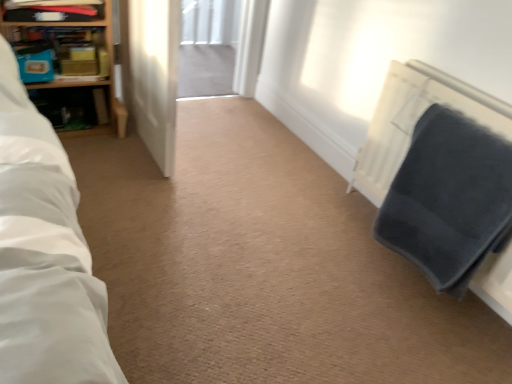
Find the location of a particular element. The image size is (512, 384). wooden bookcase at upper left is located at coordinates (70, 67).

How much space does wooden bookshelf at upper left, which is counted as the 1th shelf, starting from the bottom, occupy horizontally?

wooden bookshelf at upper left, which is counted as the 1th shelf, starting from the bottom, is 3.70 inches wide.

Image resolution: width=512 pixels, height=384 pixels. Describe the element at coordinates (152, 73) in the screenshot. I see `transparent glass screen door at center` at that location.

Locate an element on the screen. This screenshot has width=512, height=384. dark grey textured blanket at right is located at coordinates (449, 199).

This screenshot has width=512, height=384. Describe the element at coordinates (55, 12) in the screenshot. I see `wooden shelf at upper left, which is the 2th shelf in bottom-to-top order` at that location.

At what (x,y) coordinates should I click in order to perform the action: click on wooden bookcase at upper left. Please return your answer as a coordinate pair (x, y). Image resolution: width=512 pixels, height=384 pixels. Looking at the image, I should click on (70, 67).

Looking at this image, which of these two, wooden bookcase at upper left or dark grey textured blanket at right, stands taller?

wooden bookcase at upper left.

Which is more to the left, wooden bookcase at upper left or dark grey textured blanket at right?

From the viewer's perspective, wooden bookcase at upper left appears more on the left side.

What's the angular difference between wooden bookcase at upper left and dark grey textured blanket at right's facing directions?

wooden bookcase at upper left and dark grey textured blanket at right are facing 87.2 degrees away from each other.

Are wooden bookcase at upper left and dark grey textured blanket at right located far from each other?

Yes.

Based on the photo, can you confirm if wooden bookcase at upper left is positioned to the left of transparent glass screen door at center?

Correct, you'll find wooden bookcase at upper left to the left of transparent glass screen door at center.

Does point (86, 34) come closer to viewer compared to point (155, 127)?

No, it is behind (155, 127).

Considering the sizes of objects wooden bookcase at upper left and transparent glass screen door at center in the image provided, who is thinner, wooden bookcase at upper left or transparent glass screen door at center?

Thinner between the two is wooden bookcase at upper left.

From a real-world perspective, which is physically below, wooden bookcase at upper left or transparent glass screen door at center?

wooden bookcase at upper left.

Consider the image. Choose the correct answer: Is wooden shelf at upper left, which is the 2th shelf in bottom-to-top order, inside dark grey textured blanket at right or outside it?

wooden shelf at upper left, which is the 2th shelf in bottom-to-top order, is spatially situated outside dark grey textured blanket at right.

From the picture: Who is bigger, wooden shelf at upper left, which appears as the 1th shelf when viewed from the top, or dark grey textured blanket at right?

With larger size is dark grey textured blanket at right.

Based on the photo, considering the sizes of wooden shelf at upper left, which appears as the 1th shelf when viewed from the top, and dark grey textured blanket at right in the image, is wooden shelf at upper left, which appears as the 1th shelf when viewed from the top, wider or thinner than dark grey textured blanket at right?

In the image, wooden shelf at upper left, which appears as the 1th shelf when viewed from the top, appears to be wider than dark grey textured blanket at right.

In terms of size, does transparent glass screen door at center appear bigger or smaller than wooden bookshelf at upper left, acting as the second shelf starting from the top?

transparent glass screen door at center is bigger than wooden bookshelf at upper left, acting as the second shelf starting from the top.

Which is correct: transparent glass screen door at center is inside wooden bookshelf at upper left, acting as the second shelf starting from the top, or outside of it?

transparent glass screen door at center is outside wooden bookshelf at upper left, acting as the second shelf starting from the top.

Are transparent glass screen door at center and wooden bookshelf at upper left, which is counted as the 1th shelf, starting from the bottom, beside each other?

There is a gap between transparent glass screen door at center and wooden bookshelf at upper left, which is counted as the 1th shelf, starting from the bottom.

Which point is more forward, (x=165, y=43) or (x=79, y=55)?

The point (x=165, y=43) is in front.

Looking at this image, in terms of width, does wooden bookshelf at upper left, acting as the second shelf starting from the top, look wider or thinner when compared to transparent glass screen door at center?

wooden bookshelf at upper left, acting as the second shelf starting from the top, is thinner than transparent glass screen door at center.

Considering the sizes of objects wooden bookshelf at upper left, which is counted as the 1th shelf, starting from the bottom, and transparent glass screen door at center in the image provided, who is taller, wooden bookshelf at upper left, which is counted as the 1th shelf, starting from the bottom, or transparent glass screen door at center?

Standing taller between the two is transparent glass screen door at center.

Is wooden bookshelf at upper left, acting as the second shelf starting from the top, oriented towards transparent glass screen door at center?

No.

Which object is closer to the camera taking this photo, wooden bookshelf at upper left, which is counted as the 1th shelf, starting from the bottom, or transparent glass screen door at center?

Positioned in front is transparent glass screen door at center.

Is wooden bookshelf at upper left, acting as the second shelf starting from the top, shorter than wooden bookcase at upper left?

Indeed, wooden bookshelf at upper left, acting as the second shelf starting from the top, has a lesser height compared to wooden bookcase at upper left.

At what (x,y) coordinates should I click in order to perform the action: click on bookcase lying below the wooden bookshelf at upper left, which is counted as the 1th shelf, starting from the bottom (from the image's perspective). Please return your answer as a coordinate pair (x, y). Looking at the image, I should click on (70, 67).

Considering the relative sizes of wooden bookshelf at upper left, acting as the second shelf starting from the top, and wooden bookcase at upper left in the image provided, is wooden bookshelf at upper left, acting as the second shelf starting from the top, bigger than wooden bookcase at upper left?

Incorrect, wooden bookshelf at upper left, acting as the second shelf starting from the top, is not larger than wooden bookcase at upper left.

From the image's perspective, which object appears higher, wooden bookshelf at upper left, which is counted as the 1th shelf, starting from the bottom, or wooden bookcase at upper left?

wooden bookshelf at upper left, which is counted as the 1th shelf, starting from the bottom, is shown above in the image.

From the image's perspective, is dark grey textured blanket at right located beneath transparent glass screen door at center?

Yes, from the image's perspective, dark grey textured blanket at right is below transparent glass screen door at center.

The width and height of the screenshot is (512, 384). What are the coordinates of `blanket beneath the transparent glass screen door at center (from a real-world perspective)` in the screenshot? It's located at (449, 199).

Can we say dark grey textured blanket at right lies outside transparent glass screen door at center?

That's correct, dark grey textured blanket at right is outside of transparent glass screen door at center.

Considering the relative sizes of dark grey textured blanket at right and transparent glass screen door at center in the image provided, is dark grey textured blanket at right shorter than transparent glass screen door at center?

Correct, dark grey textured blanket at right is not as tall as transparent glass screen door at center.

Identify the location of blanket that is in front of the wooden bookcase at upper left. (449, 199).

Find the location of `screen door above the wooden bookcase at upper left (from a real-world perspective)`. screen door above the wooden bookcase at upper left (from a real-world perspective) is located at coordinates (152, 73).

Considering their positions, is wooden shelf at upper left, which appears as the 1th shelf when viewed from the top, positioned further to wooden bookshelf at upper left, acting as the second shelf starting from the top, than wooden bookcase at upper left?

wooden shelf at upper left, which appears as the 1th shelf when viewed from the top, lies further to wooden bookshelf at upper left, acting as the second shelf starting from the top, than the other object.

Which object lies further to the anchor point transparent glass screen door at center, dark grey textured blanket at right or wooden bookcase at upper left?

dark grey textured blanket at right.

From the image, which object appears to be farther from dark grey textured blanket at right, transparent glass screen door at center or wooden shelf at upper left, which appears as the 1th shelf when viewed from the top?

Based on the image, wooden shelf at upper left, which appears as the 1th shelf when viewed from the top, appears to be further to dark grey textured blanket at right.

Estimate the real-world distances between objects in this image. Which object is further from wooden bookcase at upper left, wooden bookshelf at upper left, acting as the second shelf starting from the top, or dark grey textured blanket at right?

dark grey textured blanket at right is further to wooden bookcase at upper left.

Looking at the image, which one is located closer to transparent glass screen door at center, wooden bookshelf at upper left, which is counted as the 1th shelf, starting from the bottom, or dark grey textured blanket at right?

The object closer to transparent glass screen door at center is wooden bookshelf at upper left, which is counted as the 1th shelf, starting from the bottom.

Based on their spatial positions, is wooden shelf at upper left, which appears as the 1th shelf when viewed from the top, or dark grey textured blanket at right closer to wooden bookshelf at upper left, which is counted as the 1th shelf, starting from the bottom?

The object closer to wooden bookshelf at upper left, which is counted as the 1th shelf, starting from the bottom, is wooden shelf at upper left, which appears as the 1th shelf when viewed from the top.

Looking at the image, which one is located further to dark grey textured blanket at right, wooden bookshelf at upper left, acting as the second shelf starting from the top, or wooden shelf at upper left, which is the 2th shelf in bottom-to-top order?

wooden shelf at upper left, which is the 2th shelf in bottom-to-top order, is positioned further to the anchor dark grey textured blanket at right.

Estimate the real-world distances between objects in this image. Which object is closer to wooden shelf at upper left, which appears as the 1th shelf when viewed from the top, wooden bookcase at upper left or wooden bookshelf at upper left, acting as the second shelf starting from the top?

wooden bookshelf at upper left, acting as the second shelf starting from the top, is positioned closer to the anchor wooden shelf at upper left, which appears as the 1th shelf when viewed from the top.

You are a GUI agent. You are given a task and a screenshot of the screen. Output one action in this format:
    pyautogui.click(x=<x>, y=<y>)
    Task: Click on the screen door between wooden bookcase at upper left and dark grey textured blanket at right in the horizontal direction
    
    Given the screenshot: What is the action you would take?
    pyautogui.click(x=152, y=73)

Identify the location of shelf between wooden bookshelf at upper left, which is counted as the 1th shelf, starting from the bottom, and dark grey textured blanket at right. Image resolution: width=512 pixels, height=384 pixels. 55,12.

You are a GUI agent. You are given a task and a screenshot of the screen. Output one action in this format:
    pyautogui.click(x=<x>, y=<y>)
    Task: Click on the shelf situated between wooden bookshelf at upper left, acting as the second shelf starting from the top, and transparent glass screen door at center from left to right
    The image size is (512, 384).
    Given the screenshot: What is the action you would take?
    pyautogui.click(x=55, y=12)

I want to click on shelf between wooden shelf at upper left, which appears as the 1th shelf when viewed from the top, and wooden bookcase at upper left, in the vertical direction, so click(x=61, y=51).